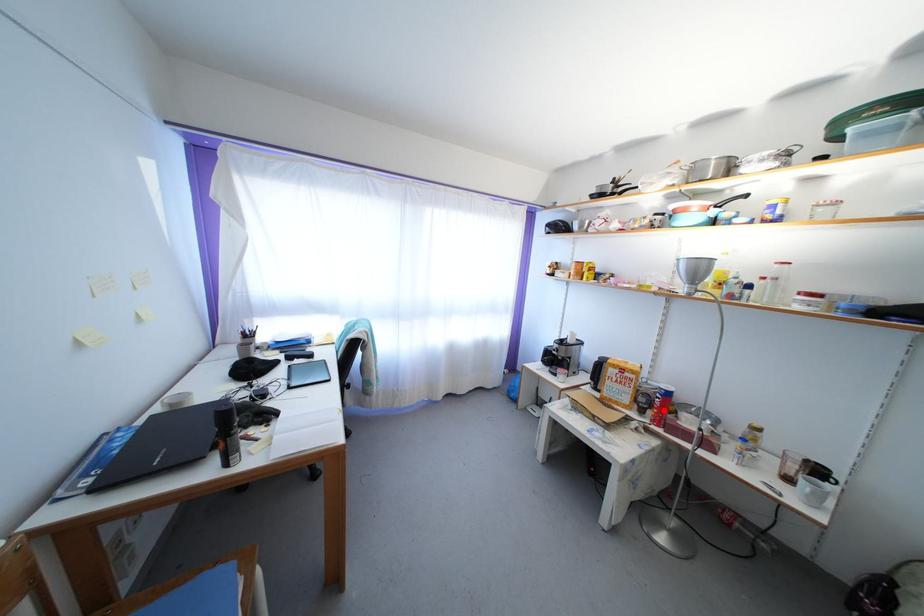
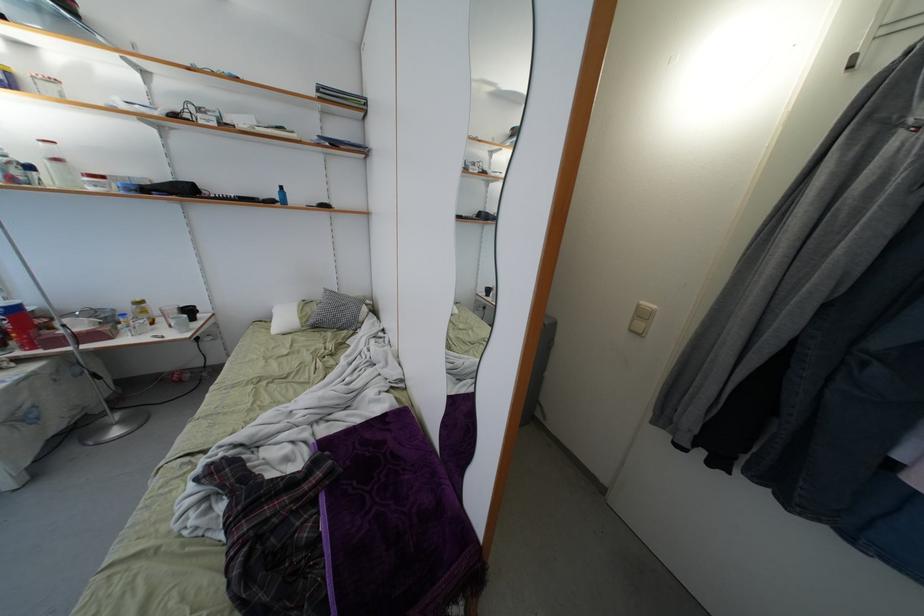
In the second image, find the point that corresponds to the highlighted location in the first image.

(22, 333)